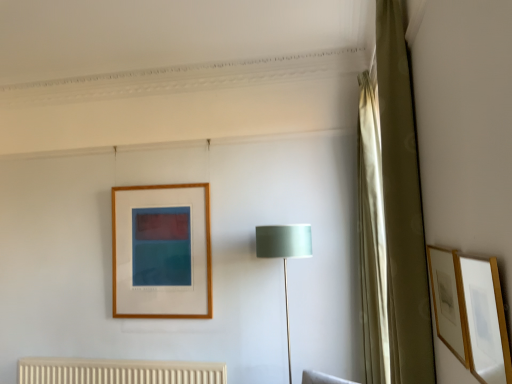
Where is `matte gold picture frame at right, which is the 1th picture frame from front to back`? This screenshot has height=384, width=512. matte gold picture frame at right, which is the 1th picture frame from front to back is located at coordinates (x=470, y=313).

Measure the distance between point (440,298) and camera.

Point (440,298) and camera are 1.41 meters apart.

What do you see at coordinates (448, 301) in the screenshot? I see `wooden picture frame at right, the 1th picture frame in the back-to-front sequence` at bounding box center [448, 301].

Describe the element at coordinates (393, 218) in the screenshot. This screenshot has width=512, height=384. I see `green fabric curtain at right, the first curtain viewed from the front` at that location.

This screenshot has height=384, width=512. In order to click on matte gold picture frame at right, which is the 1th picture frame from front to back in this screenshot , I will do `click(470, 313)`.

From the image's perspective, is satin green fabric at center above wooden picture frame at right, the 1th picture frame in the back-to-front sequence?

Actually, satin green fabric at center appears below wooden picture frame at right, the 1th picture frame in the back-to-front sequence, in the image.

At what (x,y) coordinates should I click in order to perform the action: click on table lamp on the left of the wooden picture frame at right, arranged as the 2th picture frame when viewed from the front. Please return your answer as a coordinate pair (x, y). Looking at the image, I should click on pyautogui.click(x=284, y=254).

Which is behind, point (287, 323) or point (461, 329)?

Point (287, 323)

Are satin green fabric at center and wooden picture frame at right, the 1th picture frame in the back-to-front sequence, making contact?

They are not placed beside each other.

Which object is positioned more to the left, satin green fabric at center or matte gold picture frame at right, which is the 1th picture frame from front to back?

satin green fabric at center is more to the left.

From a real-world perspective, is satin green fabric at center on matte gold picture frame at right, which is the 1th picture frame from front to back?

No, from a real-world perspective, satin green fabric at center is not over matte gold picture frame at right, which is the 1th picture frame from front to back

Considering their positions, is satin green fabric at center located in front of or behind matte gold picture frame at right, the 2th picture frame from the back?

In the image, satin green fabric at center appears behind matte gold picture frame at right, the 2th picture frame from the back.

How many degrees apart are the facing directions of matte gold picture frame at right, which is the 1th picture frame from front to back, and green fabric curtain at right, the first curtain viewed from the front?

The facing directions of matte gold picture frame at right, which is the 1th picture frame from front to back, and green fabric curtain at right, the first curtain viewed from the front, are 1.87 degrees apart.

Considering the sizes of objects matte gold picture frame at right, which is the 1th picture frame from front to back, and green fabric curtain at right, the first curtain viewed from the front, in the image provided, who is thinner, matte gold picture frame at right, which is the 1th picture frame from front to back, or green fabric curtain at right, the first curtain viewed from the front,?

Result: matte gold picture frame at right, which is the 1th picture frame from front to back, is thinner.

How much distance is there between matte gold picture frame at right, the 2th picture frame from the back, and green fabric curtain at right, the first curtain viewed from the front?

matte gold picture frame at right, the 2th picture frame from the back, and green fabric curtain at right, the first curtain viewed from the front, are 5.50 feet apart.

Is matte gold picture frame at right, which is the 1th picture frame from front to back, completely or partially outside of green fabric curtain at right, the first curtain viewed from the front?

Yes, matte gold picture frame at right, which is the 1th picture frame from front to back, is outside of green fabric curtain at right, the first curtain viewed from the front.

Looking at this image, is green fabric curtain at right, positioned as the 2th curtain in back-to-front order, far away from silky gold curtain at right, which is counted as the first curtain, starting from the back?

green fabric curtain at right, positioned as the 2th curtain in back-to-front order, is near silky gold curtain at right, which is counted as the first curtain, starting from the back, not far away.

Based on the photo, between green fabric curtain at right, positioned as the 2th curtain in back-to-front order, and silky gold curtain at right, acting as the 2th curtain starting from the front, which one has smaller size?

green fabric curtain at right, positioned as the 2th curtain in back-to-front order, is smaller.

Is green fabric curtain at right, the first curtain viewed from the front, wider or thinner than silky gold curtain at right, acting as the 2th curtain starting from the front?

green fabric curtain at right, the first curtain viewed from the front, is thinner than silky gold curtain at right, acting as the 2th curtain starting from the front.

Is green fabric curtain at right, the first curtain viewed from the front, taller or shorter than silky gold curtain at right, which is counted as the first curtain, starting from the back?

In the image, green fabric curtain at right, the first curtain viewed from the front, appears to be shorter than silky gold curtain at right, which is counted as the first curtain, starting from the back.

Is wooden picture frame at right, the 1th picture frame in the back-to-front sequence, aimed at satin green fabric at center?

No, wooden picture frame at right, the 1th picture frame in the back-to-front sequence, does not turn towards satin green fabric at center.

From the picture: Considering the relative sizes of wooden picture frame at right, arranged as the 2th picture frame when viewed from the front, and satin green fabric at center in the image provided, is wooden picture frame at right, arranged as the 2th picture frame when viewed from the front, taller than satin green fabric at center?

No, wooden picture frame at right, arranged as the 2th picture frame when viewed from the front, is not taller than satin green fabric at center.

Which is in front, wooden picture frame at right, arranged as the 2th picture frame when viewed from the front, or satin green fabric at center?

wooden picture frame at right, arranged as the 2th picture frame when viewed from the front, is in front.

This screenshot has height=384, width=512. Identify the location of picture frame that is the 2nd object above the satin green fabric at center (from a real-world perspective). (448, 301).

From a real-world perspective, is silky gold curtain at right, which is counted as the first curtain, starting from the back, located higher than wooden picture frame at right, the 1th picture frame in the back-to-front sequence?

Yes.

Which object is wider, silky gold curtain at right, acting as the 2th curtain starting from the front, or wooden picture frame at right, the 1th picture frame in the back-to-front sequence?

Wider between the two is silky gold curtain at right, acting as the 2th curtain starting from the front.

Is silky gold curtain at right, which is counted as the first curtain, starting from the back, positioned far away from wooden picture frame at right, the 1th picture frame in the back-to-front sequence?

Absolutely, silky gold curtain at right, which is counted as the first curtain, starting from the back, is distant from wooden picture frame at right, the 1th picture frame in the back-to-front sequence.

Looking at this image, could you tell me if silky gold curtain at right, acting as the 2th curtain starting from the front, is turned towards wooden picture frame at right, arranged as the 2th picture frame when viewed from the front?

No, silky gold curtain at right, acting as the 2th curtain starting from the front, is not facing towards wooden picture frame at right, arranged as the 2th picture frame when viewed from the front.

Can you tell me how much silky gold curtain at right, acting as the 2th curtain starting from the front, and matte gold picture frame at right, which is the 1th picture frame from front to back, differ in facing direction?

There is a 1.87-degree angle between the facing directions of silky gold curtain at right, acting as the 2th curtain starting from the front, and matte gold picture frame at right, which is the 1th picture frame from front to back.

Is point (364, 186) less distant than point (452, 311)?

No, (364, 186) is further to viewer.

Considering the relative positions of silky gold curtain at right, which is counted as the first curtain, starting from the back, and matte gold picture frame at right, which is the 1th picture frame from front to back, in the image provided, is silky gold curtain at right, which is counted as the first curtain, starting from the back, to the right of matte gold picture frame at right, which is the 1th picture frame from front to back, from the viewer's perspective?

Correct, you'll find silky gold curtain at right, which is counted as the first curtain, starting from the back, to the right of matte gold picture frame at right, which is the 1th picture frame from front to back.

From the image's perspective, relative to matte gold picture frame at right, which is the 1th picture frame from front to back, is silky gold curtain at right, acting as the 2th curtain starting from the front, above or below?

silky gold curtain at right, acting as the 2th curtain starting from the front, is situated higher than matte gold picture frame at right, which is the 1th picture frame from front to back, in the image.

Where is `table lamp that appears on the left of wooden picture frame at right, arranged as the 2th picture frame when viewed from the front`? The height and width of the screenshot is (384, 512). table lamp that appears on the left of wooden picture frame at right, arranged as the 2th picture frame when viewed from the front is located at coordinates (284, 254).

Find the location of a particular element. Image resolution: width=512 pixels, height=384 pixels. picture frame that is the 1st object to the right of the satin green fabric at center, starting at the anchor is located at coordinates (470, 313).

Estimate the real-world distances between objects in this image. Which object is closer to satin green fabric at center, silky gold curtain at right, acting as the 2th curtain starting from the front, or matte gold picture frame at right, the 2th picture frame from the back?

Among the two, silky gold curtain at right, acting as the 2th curtain starting from the front, is located nearer to satin green fabric at center.

Which object lies further to the anchor point matte gold picture frame at right, which is the 1th picture frame from front to back, silky gold curtain at right, which is counted as the first curtain, starting from the back, or wooden picture frame at right, the 1th picture frame in the back-to-front sequence?

Based on the image, silky gold curtain at right, which is counted as the first curtain, starting from the back, appears to be further to matte gold picture frame at right, which is the 1th picture frame from front to back.

Based on their spatial positions, is green fabric curtain at right, positioned as the 2th curtain in back-to-front order, or matte gold picture frame at right, which is the 1th picture frame from front to back, further from satin green fabric at center?

matte gold picture frame at right, which is the 1th picture frame from front to back, lies further to satin green fabric at center than the other object.

From the image, which object appears to be farther from silky gold curtain at right, acting as the 2th curtain starting from the front, satin green fabric at center or matte gold picture frame at right, which is the 1th picture frame from front to back?

Among the two, matte gold picture frame at right, which is the 1th picture frame from front to back, is located further to silky gold curtain at right, acting as the 2th curtain starting from the front.

When comparing their distances from silky gold curtain at right, acting as the 2th curtain starting from the front, does green fabric curtain at right, the first curtain viewed from the front, or matte gold picture frame at right, the 2th picture frame from the back, seem closer?

green fabric curtain at right, the first curtain viewed from the front.

From the image, which object appears to be farther from matte gold picture frame at right, which is the 1th picture frame from front to back, silky gold curtain at right, which is counted as the first curtain, starting from the back, or green fabric curtain at right, the first curtain viewed from the front?

Based on the image, green fabric curtain at right, the first curtain viewed from the front, appears to be further to matte gold picture frame at right, which is the 1th picture frame from front to back.

Considering their positions, is matte gold picture frame at right, the 2th picture frame from the back, positioned further to silky gold curtain at right, acting as the 2th curtain starting from the front, than green fabric curtain at right, positioned as the 2th curtain in back-to-front order?

matte gold picture frame at right, the 2th picture frame from the back, lies further to silky gold curtain at right, acting as the 2th curtain starting from the front, than the other object.

Which object lies nearer to the anchor point matte gold picture frame at right, the 2th picture frame from the back, green fabric curtain at right, positioned as the 2th curtain in back-to-front order, or silky gold curtain at right, acting as the 2th curtain starting from the front?

silky gold curtain at right, acting as the 2th curtain starting from the front, is closer to matte gold picture frame at right, the 2th picture frame from the back.

Where is `curtain between matte gold picture frame at right, which is the 1th picture frame from front to back, and silky gold curtain at right, acting as the 2th curtain starting from the front, in the front-back direction`? This screenshot has height=384, width=512. curtain between matte gold picture frame at right, which is the 1th picture frame from front to back, and silky gold curtain at right, acting as the 2th curtain starting from the front, in the front-back direction is located at coordinates (393, 218).

Locate an element on the screen. The image size is (512, 384). curtain located between wooden picture frame at right, arranged as the 2th picture frame when viewed from the front, and satin green fabric at center in the depth direction is located at coordinates (393, 218).

The height and width of the screenshot is (384, 512). What are the coordinates of `table lamp located between green fabric curtain at right, the first curtain viewed from the front, and silky gold curtain at right, acting as the 2th curtain starting from the front, in the depth direction` in the screenshot? It's located at (284, 254).

Find the location of a particular element. picture frame positioned between matte gold picture frame at right, which is the 1th picture frame from front to back, and satin green fabric at center from near to far is located at coordinates (448, 301).